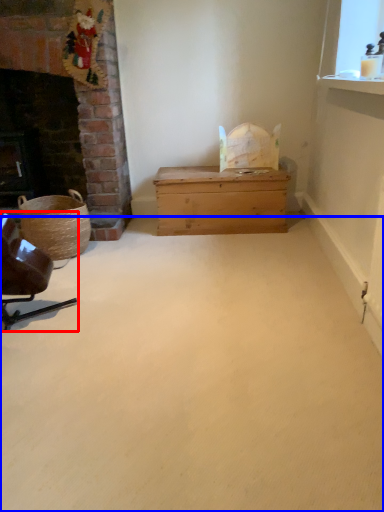
Question: Which object is closer to the camera taking this photo, chair (highlighted by a red box) or plain (highlighted by a blue box)?

Choices:
 (A) chair
 (B) plain

Answer: (B)